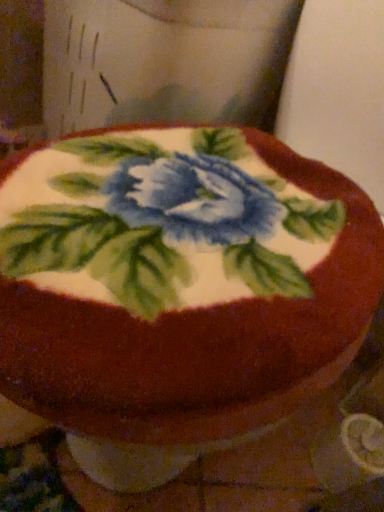
This screenshot has height=512, width=384. What do you see at coordinates (177, 290) in the screenshot?
I see `matte ceramic bowl at center` at bounding box center [177, 290].

This screenshot has width=384, height=512. What are the coordinates of `matte ceramic bowl at center` in the screenshot? It's located at 177,290.

Where is `matte ceramic bowl at center`? Image resolution: width=384 pixels, height=512 pixels. matte ceramic bowl at center is located at coordinates (177, 290).